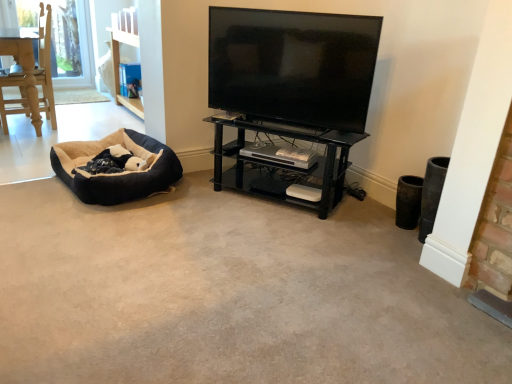
Locate an element on the screen. The image size is (512, 384). vacant space underneath black glossy tv at upper center (from a real-world perspective) is located at coordinates (281, 121).